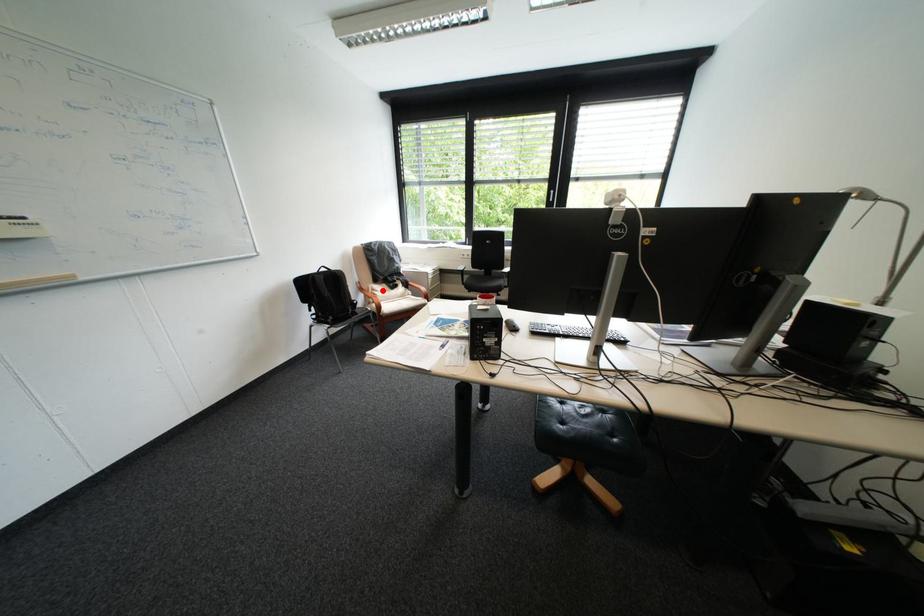
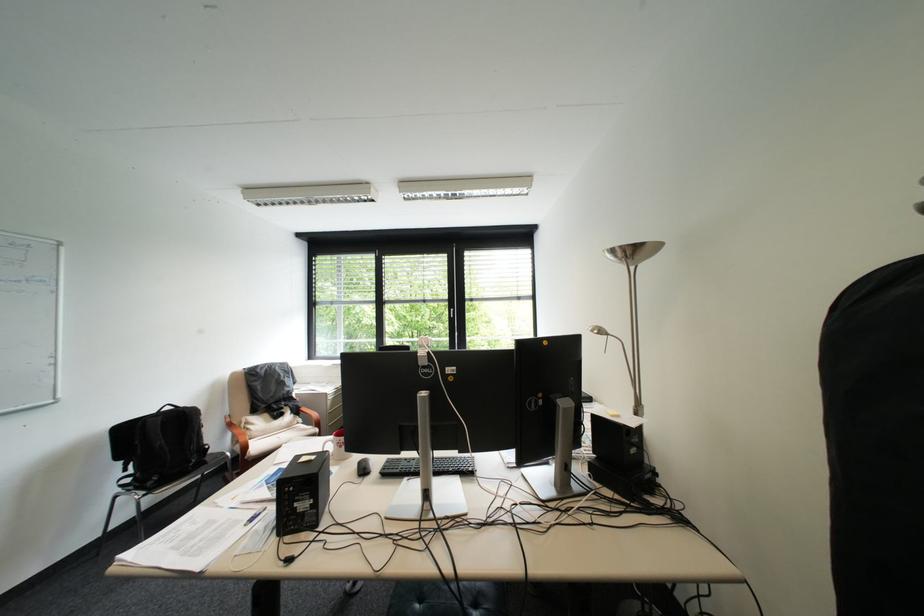
Locate, in the second image, the point that corresponds to the highlighted location in the first image.

(256, 424)